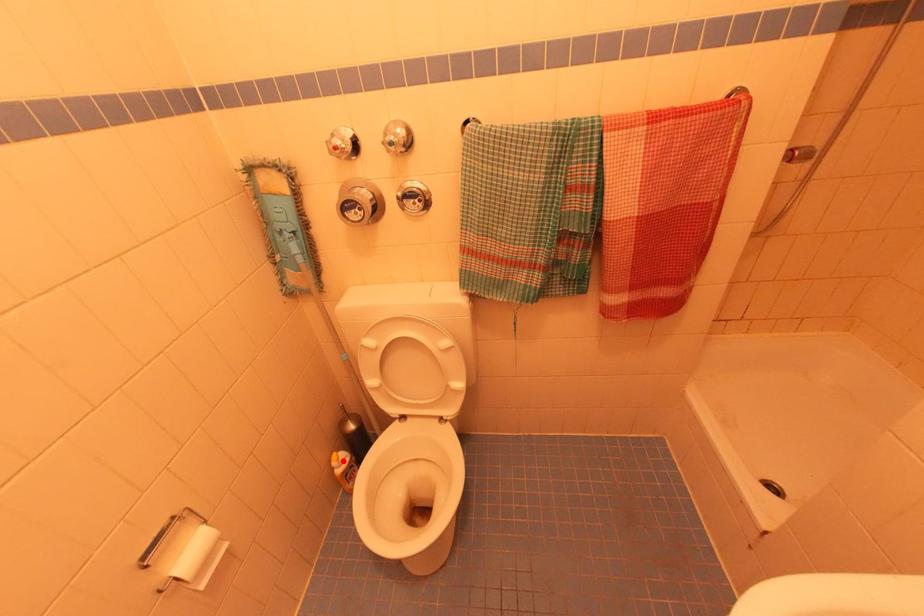
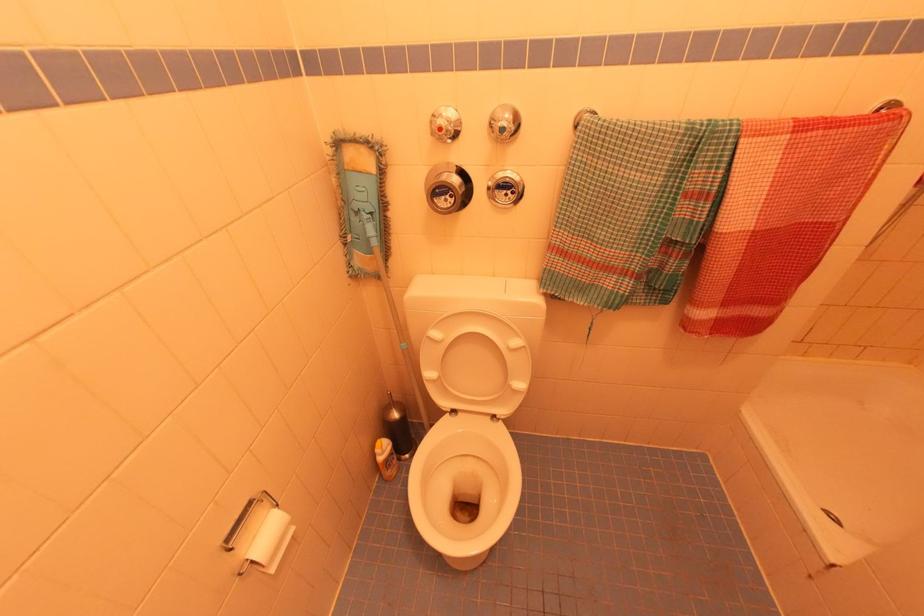
The point at the highlighted location is marked in the first image. Where is the corresponding point in the second image?

(385, 448)